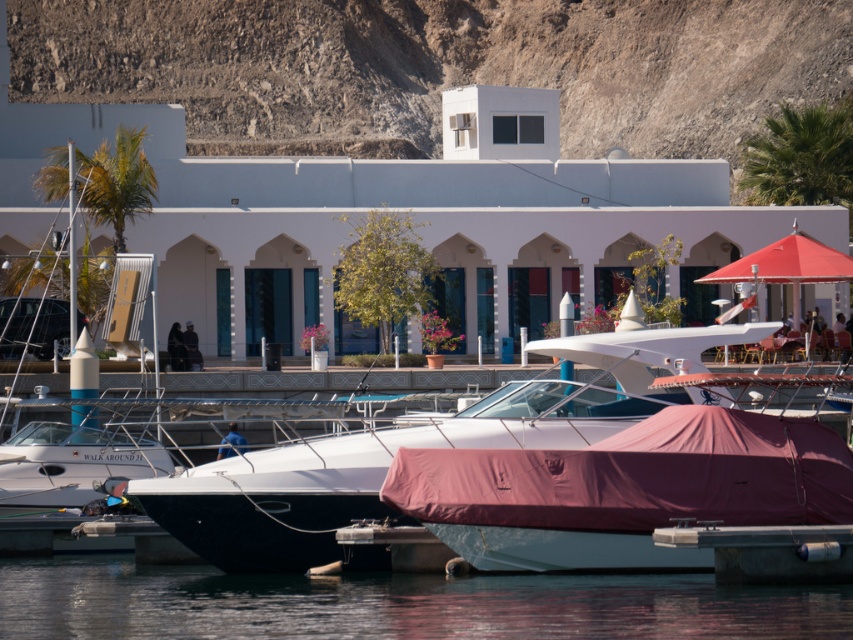
You are standing on the dock and want to take a photo of the transparent water at lower center and the white matte boat at center. Which object will appear larger in the photo?

The transparent water at lower center will appear larger in the photo because it is closer to the viewer than the white matte boat at center.

You are a photographer planning to take a wide shot of the waterfront scene. You want to ensure both the dull gray rock at upper center and the white matte boat at center are clearly visible in the frame. Given their sizes, which object might require you to adjust your camera angle to prevent it from being overshadowed by the other?

The dull gray rock at upper center is bigger than the white matte boat at center, so you might need to adjust your camera angle to ensure the smaller white matte boat at center isn